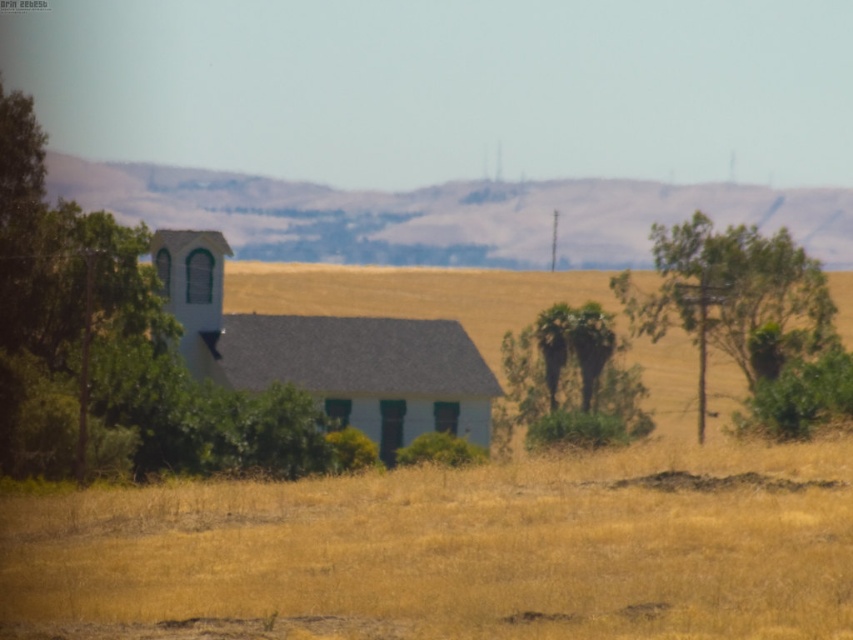
Question: Estimate the real-world distances between objects in this image. Which object is farther from the white matte church at center?

Choices:
 (A) green leafy tree at left
 (B) green leafy tree at right
 (C) dry grass at center

Answer: (C)

Question: Can you confirm if white matte church at center is positioned above green leafy tree at right?

Choices:
 (A) yes
 (B) no

Answer: (B)

Question: Is dry grass at center smaller than green leafy tree at right?

Choices:
 (A) no
 (B) yes

Answer: (B)

Question: Estimate the real-world distances between objects in this image. Which object is farther from the green leafy tree at right?

Choices:
 (A) white matte church at center
 (B) dry grass at center

Answer: (B)

Question: Where is green leafy tree at left located in relation to white matte church at center in the image?

Choices:
 (A) right
 (B) left

Answer: (B)

Question: Which point is farther to the camera?

Choices:
 (A) green leafy tree at left
 (B) green leafy tree at right
 (C) white matte church at center
 (D) dry grass at center

Answer: (B)